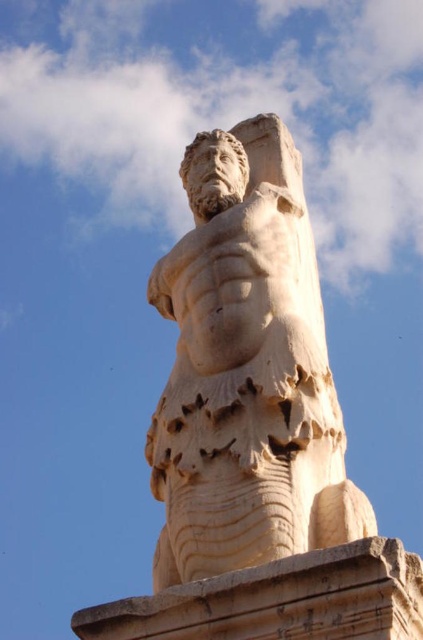
Question: Can you confirm if white marble statue at center is bigger than beige stone pillar at center?

Choices:
 (A) no
 (B) yes

Answer: (B)

Question: Which of the following is the closest to the observer?

Choices:
 (A) beige stone pillar at center
 (B) white marble statue at center

Answer: (A)

Question: Does white marble statue at center appear under beige stone pillar at center?

Choices:
 (A) no
 (B) yes

Answer: (A)

Question: Which point is farther to the camera?

Choices:
 (A) beige stone pillar at center
 (B) white marble statue at center

Answer: (B)

Question: Does white marble statue at center appear on the right side of beige stone pillar at center?

Choices:
 (A) yes
 (B) no

Answer: (B)